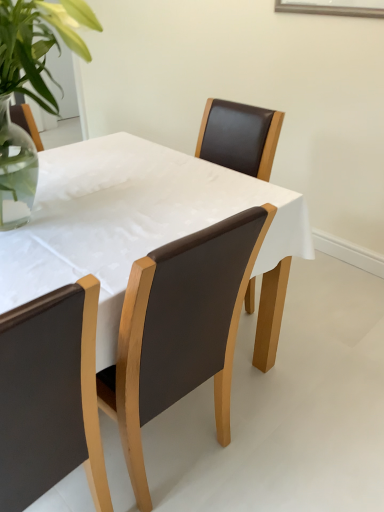
Question: Considering their positions, is brown leather chair at center, the 2th chair in the left-to-right sequence, located in front of or behind matte black chair at lower left, arranged as the first chair when viewed from the left?

Choices:
 (A) behind
 (B) front

Answer: (A)

Question: In terms of height, does brown leather chair at center, the 2th chair in the left-to-right sequence, look taller or shorter compared to matte black chair at lower left, arranged as the first chair when viewed from the left?

Choices:
 (A) short
 (B) tall

Answer: (A)

Question: Which object is positioned closest to the brown leather chair at center, acting as the 1th chair starting from the right?

Choices:
 (A) matte black chair at lower left, arranged as the first chair when viewed from the left
 (B) matte brown table at center

Answer: (A)

Question: Estimate the real-world distances between objects in this image. Which object is farther from the matte brown table at center?

Choices:
 (A) matte black chair at lower left, arranged as the first chair when viewed from the left
 (B) brown leather chair at center, acting as the 1th chair starting from the right

Answer: (A)